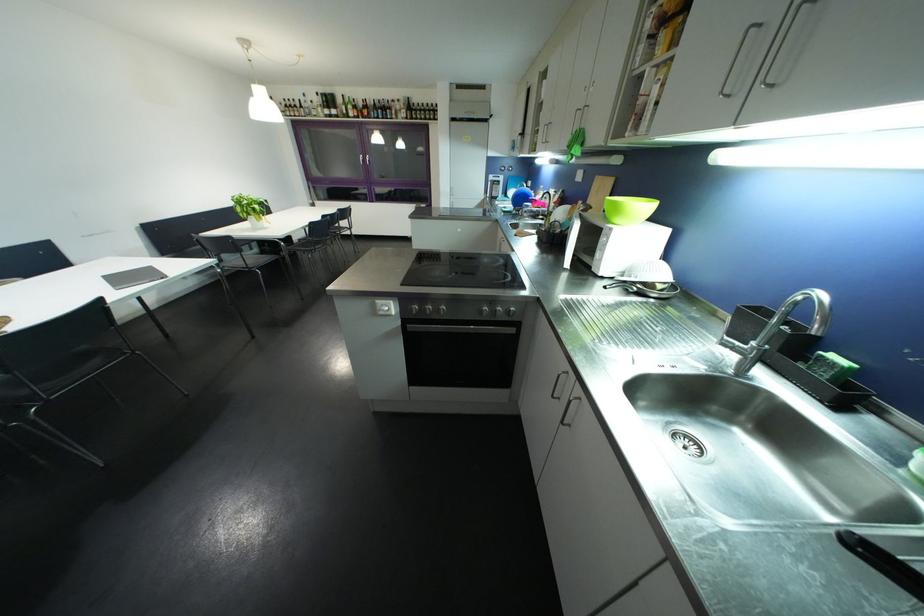
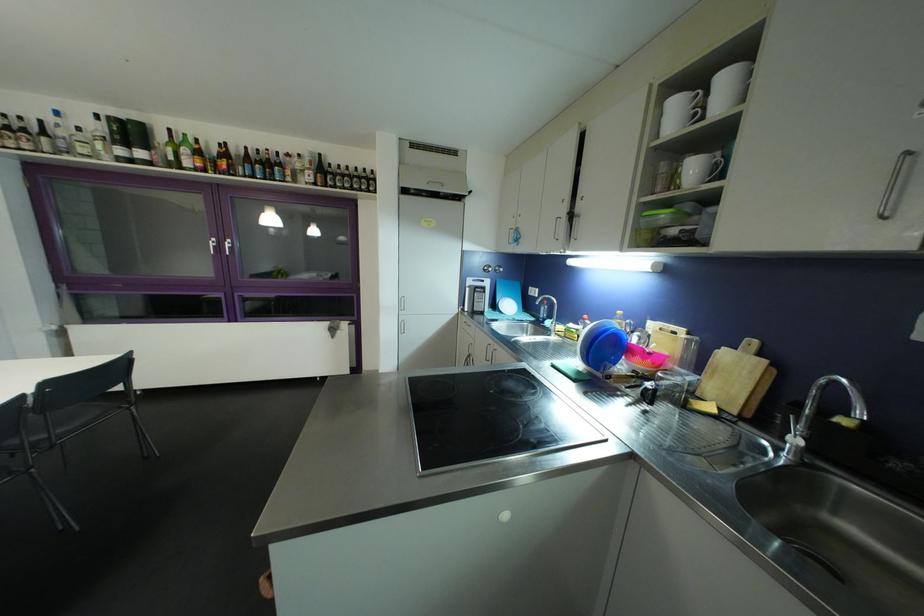
Question: Which direction would the cameraman need to move to produce the second image? Reply with the corresponding letter.

Choices:
 (A) Left
 (B) Right
 (C) Forward
 (D) Backward

Answer: (C)